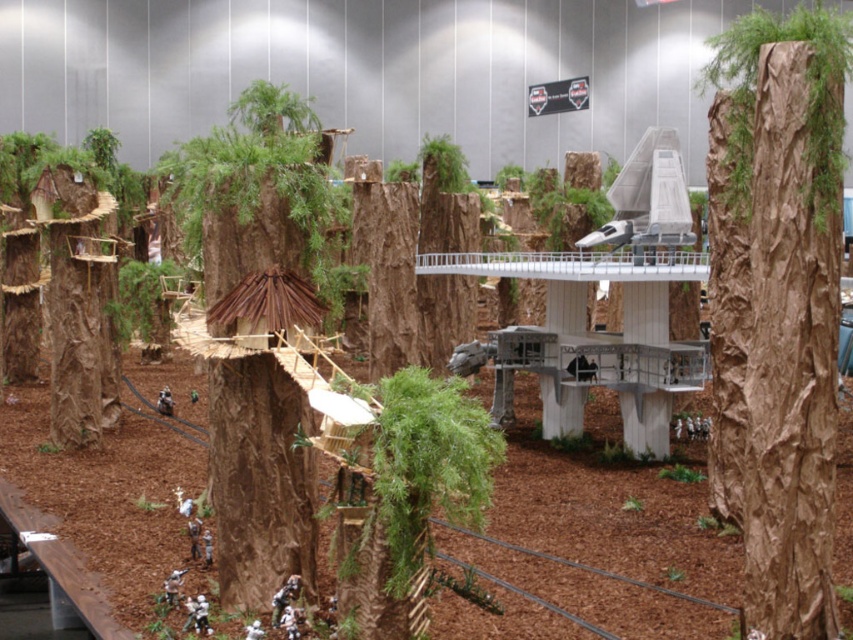
Does metallic silver fighter jet at center have a greater height compared to green mossy tree at center?

Correct, metallic silver fighter jet at center is much taller as green mossy tree at center.

Who is taller, metallic silver fighter jet at center or green mossy tree at center?

metallic silver fighter jet at center

What do you see at coordinates (622, 307) in the screenshot?
I see `metallic silver fighter jet at center` at bounding box center [622, 307].

Where is `metallic silver fighter jet at center`? metallic silver fighter jet at center is located at coordinates (622, 307).

In the scene shown: Is brown textured bark at center above metallic silver fighter jet at center?

No.

Which is more to the left, brown textured bark at center or metallic silver fighter jet at center?

From the viewer's perspective, metallic silver fighter jet at center appears more on the left side.

Where is `brown textured bark at center`? This screenshot has width=853, height=640. brown textured bark at center is located at coordinates (784, 296).

Does brown textured tree trunk at center appear over green mossy tree at center?

Yes, brown textured tree trunk at center is above green mossy tree at center.

Is brown textured tree trunk at center taller than green mossy tree at center?

Correct, brown textured tree trunk at center is much taller as green mossy tree at center.

The height and width of the screenshot is (640, 853). Identify the location of brown textured tree trunk at center. pyautogui.click(x=260, y=209).

This screenshot has height=640, width=853. I want to click on brown textured tree trunk at center, so click(260, 209).